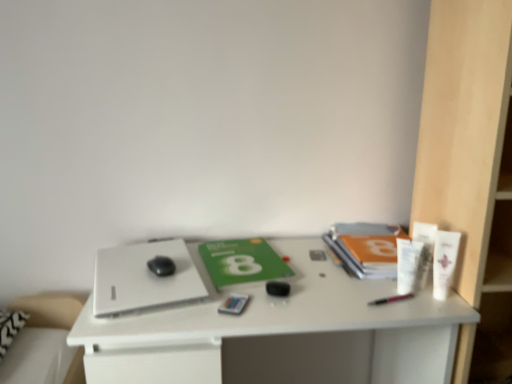
Identify the location of vacant space behind matte plastic card at center, which appears as the first stationery when viewed from the left. The width and height of the screenshot is (512, 384). (248, 285).